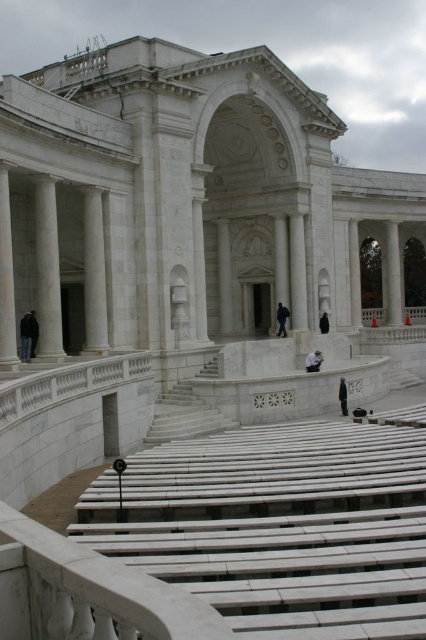
You are standing in front of the grand neoclassical building and want to take a photo that includes both the white marble column at left and the tiered seating area. Considering your camera has a maximum zoom range of 50 meters, will you be able to capture both elements in the same frame without moving closer?

The white marble column at left is 46.77 meters away from the viewer. Since the camera can zoom up to 50 meters, it is possible to capture both the column and the tiered seating area in the same frame without moving closer.

You are standing in front of the grand neoclassical building and see the white marble column at center and the white fabric bag at center. Which object takes up more space in the scene?

The white marble column at center is bigger than the white fabric bag at center, so it takes up more space in the scene.